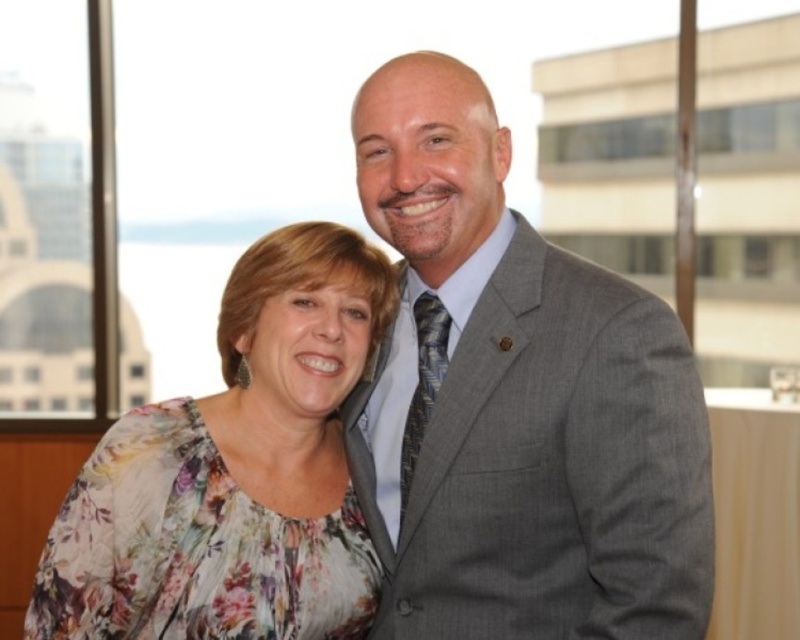
You are standing in the room and want to locate the gray textured suit at center. What are the coordinates where you can find it?

The gray textured suit at center can be found at coordinates point [516,401].

You are organizing a photo shoot and need to arrange two outfits on a mannequin. The gray textured suit at center and the floral fabric blouse at center are the options. Based on their sizes, which outfit should you choose if you want the one that takes up more space?

The gray textured suit at center has a larger size compared to the floral fabric blouse at center, so you should choose the gray textured suit at center if you want the outfit that takes up more space.